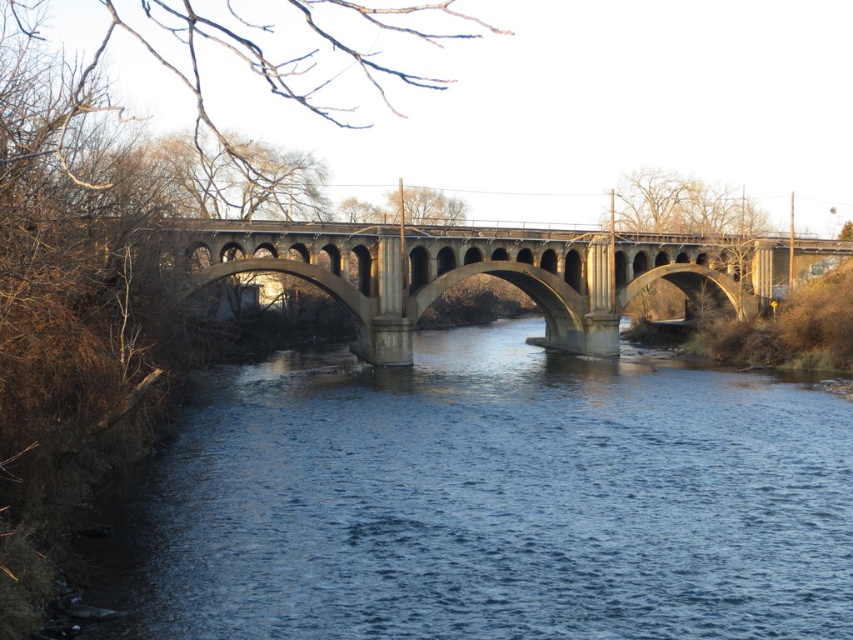
You are standing on the riverbank and want to cross to the other side. The concrete bridge at center is in your way. Can you see the blue water at center from your current position?

Yes, because the blue water at center is in front of the concrete bridge at center, so it is visible from the riverbank even with the bridge in the way.

You are a pedestrian standing on the concrete bridge at center. Looking down, you see the blue water at center. Can you confirm if the water is directly beneath the bridge?

Yes, the blue water at center is positioned under the concrete bridge at center, so the water is directly beneath the bridge.